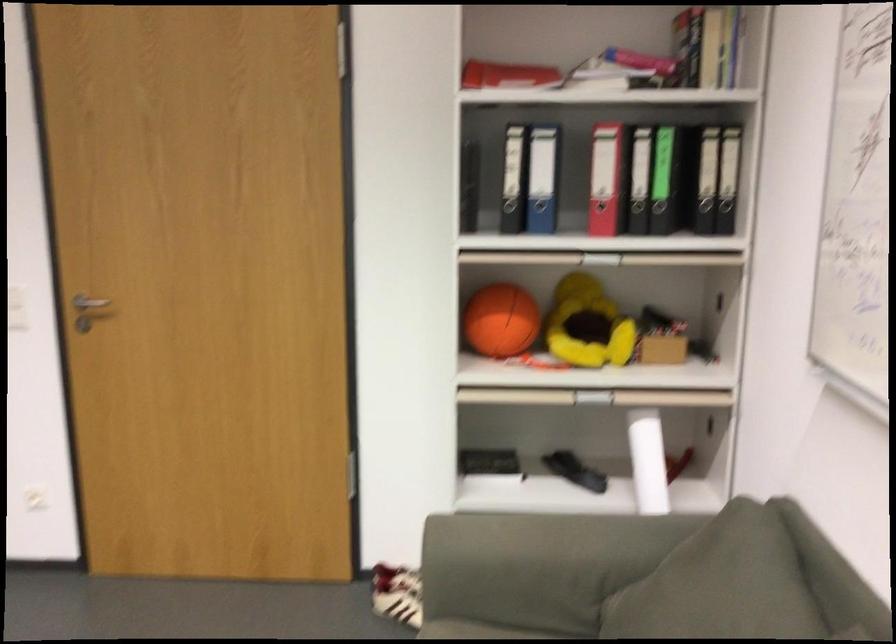
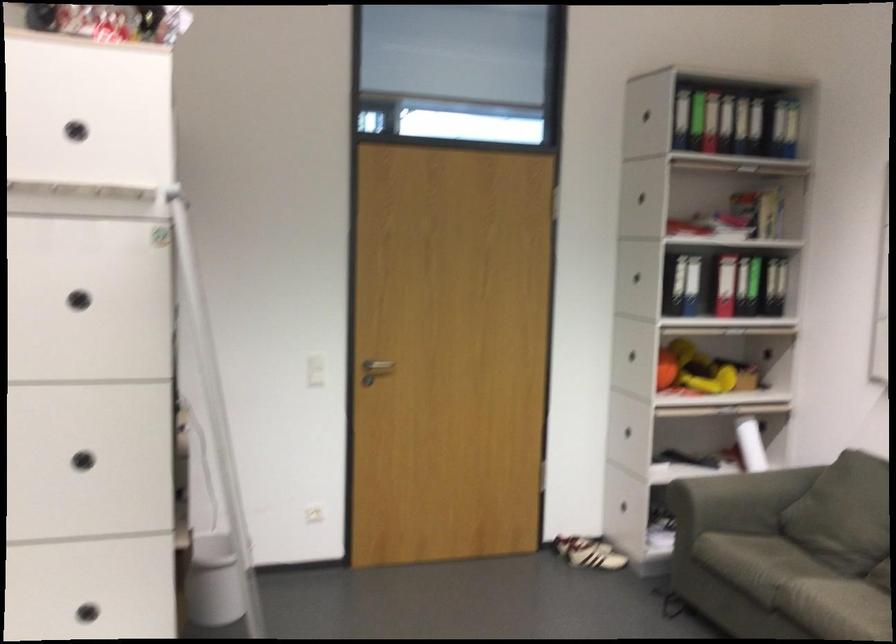
Where in the second image is the point corresponding to (633,466) from the first image?

(750, 444)